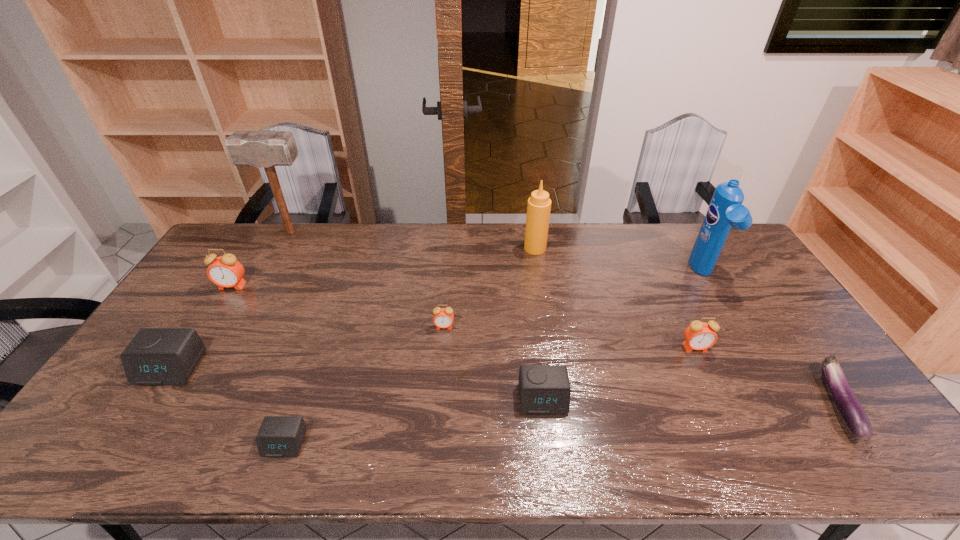
Locate an element on the screen. This screenshot has height=540, width=960. vacant point that satisfies the following two spatial constraints: 1. on the face of the biggest pink alarm clock; 2. on the left side of the purple eggplant is located at coordinates (159, 402).

The width and height of the screenshot is (960, 540). I want to click on free space that satisfies the following two spatial constraints: 1. on the striking face of the farthest object; 2. on the right side of the tan condiment, so click(282, 248).

At what (x,y) coordinates should I click in order to perform the action: click on free space that satisfies the following two spatial constraints: 1. on the face of the eggplant; 2. on the left side of the nearest pink alarm clock. Please return your answer as a coordinate pair (x, y). Looking at the image, I should click on (721, 402).

At what (x,y) coordinates should I click in order to perform the action: click on vacant space that satisfies the following two spatial constraints: 1. on the face of the sixth object from right to left; 2. on the left side of the rightmost object. Please return your answer as a coordinate pair (x, y). Image resolution: width=960 pixels, height=540 pixels. Looking at the image, I should click on (438, 402).

At what (x,y) coordinates should I click in order to perform the action: click on free space that satisfies the following two spatial constraints: 1. on the front side of the ninth nearest object; 2. on the left side of the ninth object from left to right. Please return your answer as a coordinate pair (x, y). The height and width of the screenshot is (540, 960). Looking at the image, I should click on [x=539, y=274].